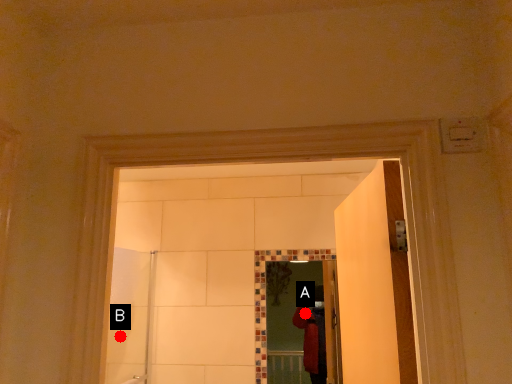
Question: Two points are circled on the image, labeled by A and B beside each circle. Which of the following is the farthest from the observer?

Choices:
 (A) A is further
 (B) B is further

Answer: (B)